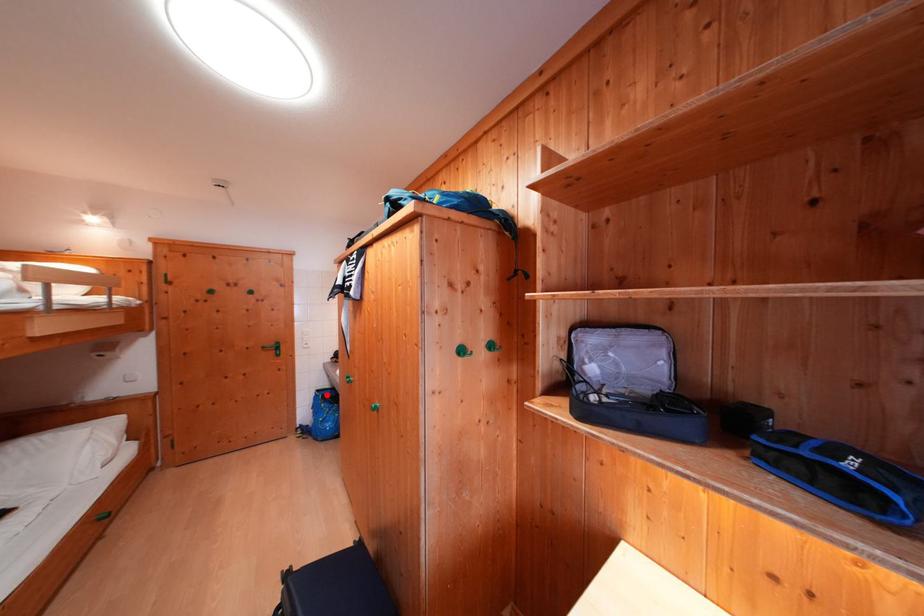
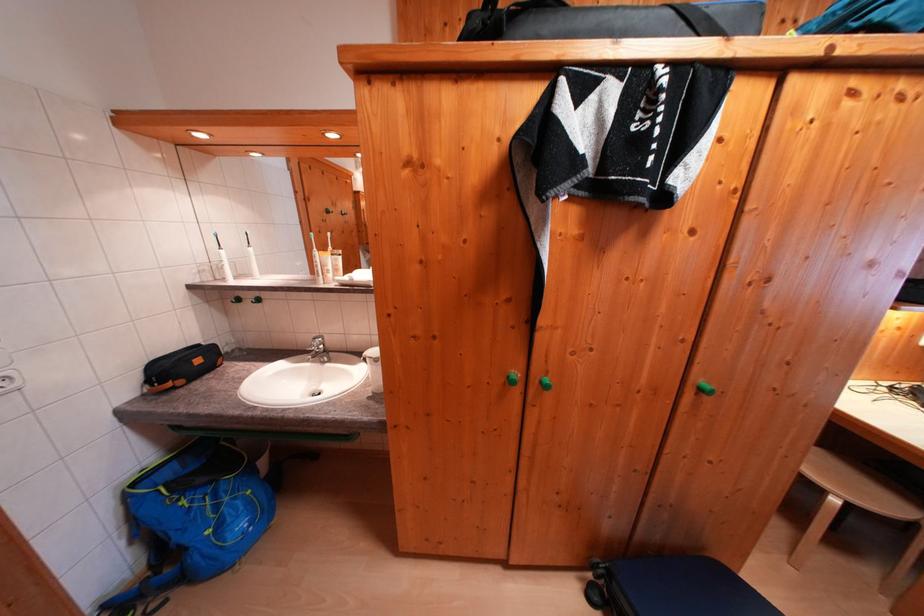
Locate, in the second image, the point that corresponds to the highlighted location in the first image.

(142, 488)